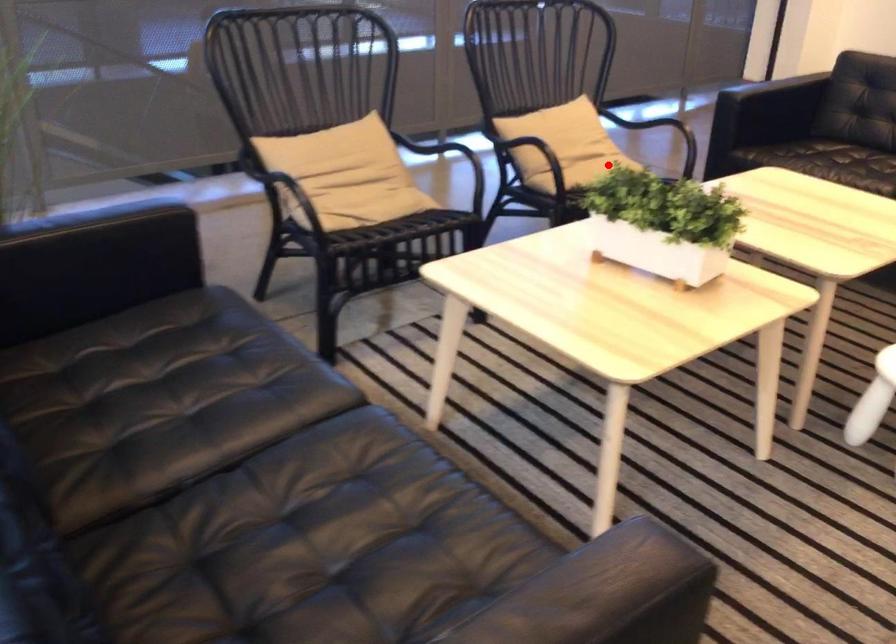
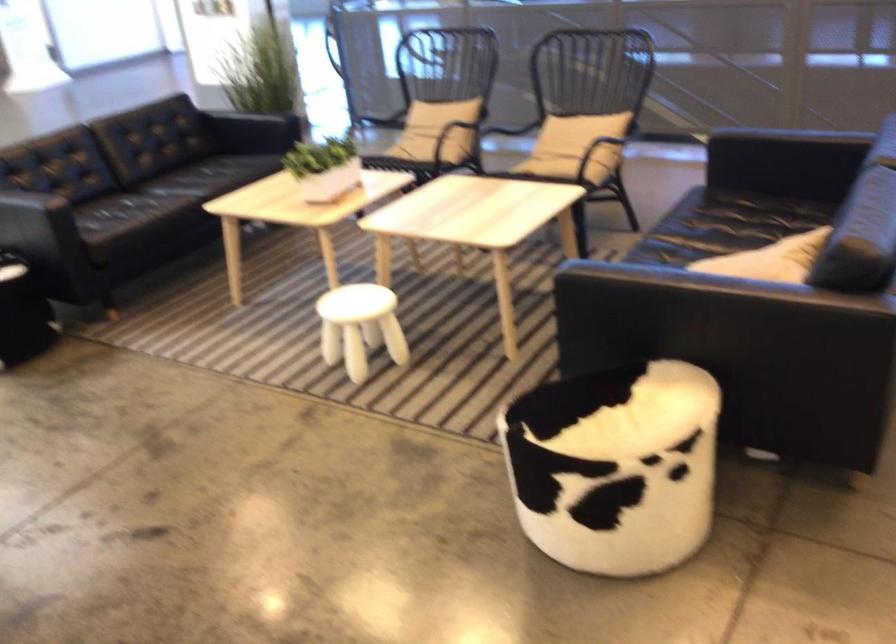
Where in the second image is the point corresponding to the highlighted location from the first image?

(552, 160)